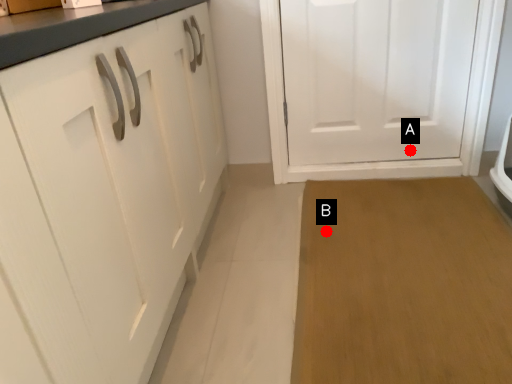
Question: Two points are circled on the image, labeled by A and B beside each circle. Which point appears farthest from the camera in this image?

Choices:
 (A) A is further
 (B) B is further

Answer: (A)